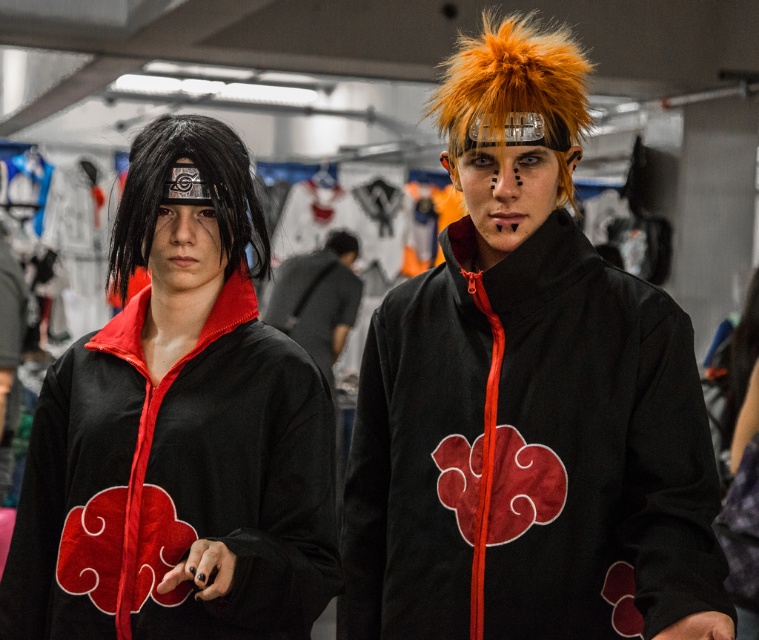
You are at a cosplay event and need to adjust the positioning of the orange spiky wig at upper right and the black synthetic wig at left. Which wig should you move closer to the front of the display area to maintain the current perspective?

The orange spiky wig at upper right is already closer to the viewer than the black synthetic wig at left, so to maintain the current perspective, you should not move the orange spiky wig at upper right closer. Keep it as is.

You are a photographer standing at the camera position. You want to take a photo of the velvet black jacket at upper right. Is the jacket within your reach if you can extend your arm 1.6 meters?

The velvet black jacket at upper right is 1.70 meters away from the camera. Since your arm can only extend 1.6 meters, you cannot reach it.

You are a photographer at a cosplay event. You need to adjust the lighting so that both the orange spiky wig at upper right and the black synthetic wig at left are well lit. Which wig should you focus on first if you want to light the one closer to the right side of the frame?

The orange spiky wig at upper right is positioned on the right side of the black synthetic wig at left, so you should focus on lighting the orange spiky wig at upper right first since it is closer to the right side of the frame.